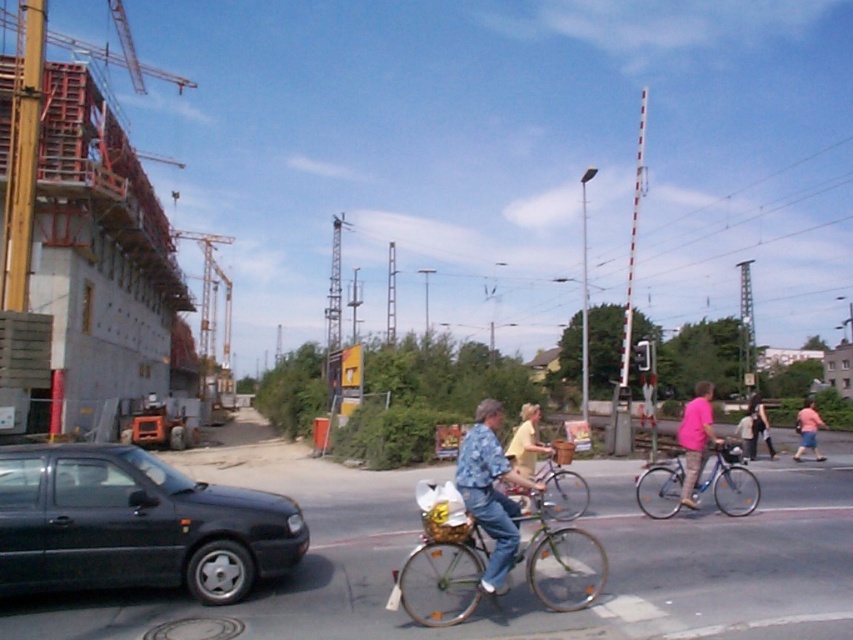
You are a pedestrian standing at the intersection. You see a matte black car at left and a shiny silver bicycle at center. Which object is positioned higher in the image?

The matte black car at left is located above the shiny silver bicycle at center in the image.

You are a delivery person who needs to quickly move your shiny silver bicycle at center and metallic silver bicycle at center to the side of the road to avoid blocking the sidewalk. Since both bicycles are in the middle of the road, which bicycle should you move first based on their positions?

The shiny silver bicycle at center is positioned over metallic silver bicycle at center, so you should move the metallic silver bicycle at center first as it is underneath the other one and needs to be moved out first to access the one on top.